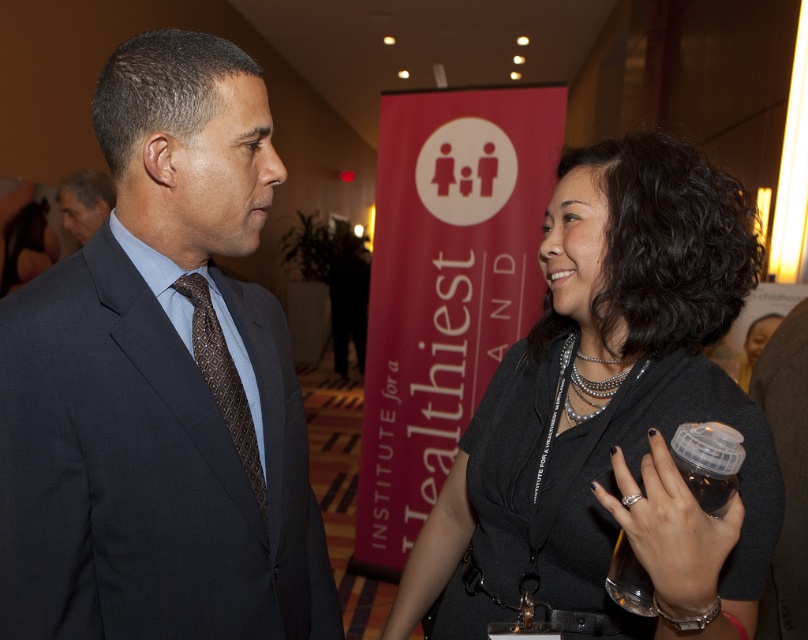
Question: Based on their relative distances, which object is nearer to the black fabric shirt at center?

Choices:
 (A) matte black suit at left
 (B) dark gray suit at left
 (C) brown textured tie at left

Answer: (B)

Question: Is brown textured tie at left further to the viewer compared to matte black suit at left?

Choices:
 (A) yes
 (B) no

Answer: (B)

Question: Which of the following is the closest to the observer?

Choices:
 (A) dark gray suit at left
 (B) black fabric shirt at center
 (C) brown textured tie at left
 (D) matte black suit at left

Answer: (B)

Question: Which point is closer to the camera?

Choices:
 (A) black fabric shirt at center
 (B) dark gray suit at left

Answer: (A)

Question: Is dark gray suit at left wider than matte black suit at left?

Choices:
 (A) yes
 (B) no

Answer: (A)

Question: Does brown textured tie at left appear on the left side of matte black suit at left?

Choices:
 (A) no
 (B) yes

Answer: (A)